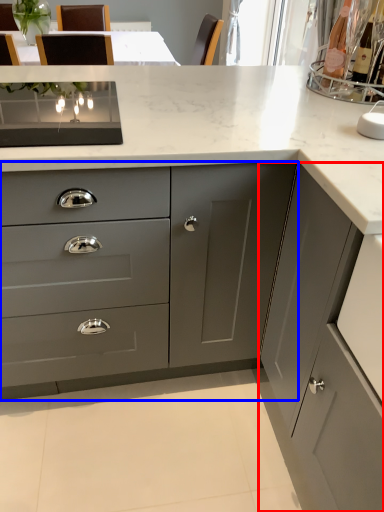
Question: Which object appears closest to the camera in this image, cabinetry (highlighted by a red box) or cabinetry (highlighted by a blue box)?

Choices:
 (A) cabinetry
 (B) cabinetry

Answer: (A)